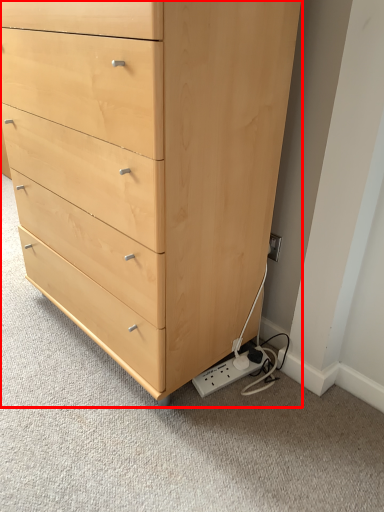
Question: From the image's perspective, considering the relative positions of chest of drawers (annotated by the red box) and plug in the image provided, where is chest of drawers (annotated by the red box) located with respect to the staircase?

Choices:
 (A) above
 (B) below

Answer: (A)